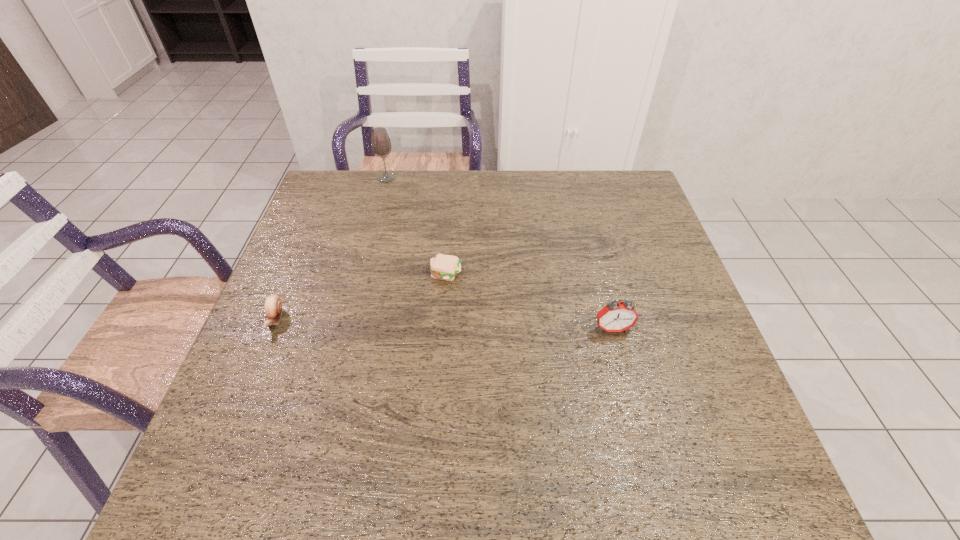
Where is `vacant region at the near right corner`? vacant region at the near right corner is located at coordinates (701, 464).

Find the location of `empty space between the rightmost object and the third object from right to left`. empty space between the rightmost object and the third object from right to left is located at coordinates (499, 253).

You are a GUI agent. You are given a task and a screenshot of the screen. Output one action in this format:
    pyautogui.click(x=<x>, y=<y>)
    Task: Click on the vacant area between the third shortest object and the tallest object
    This screenshot has width=960, height=540.
    Given the screenshot: What is the action you would take?
    pyautogui.click(x=499, y=253)

This screenshot has height=540, width=960. Identify the location of free spot between the tallest object and the second farthest object. (417, 226).

Locate an element on the screen. Image resolution: width=960 pixels, height=540 pixels. vacant point located between the glass drink container and the leftmost object is located at coordinates (331, 248).

You are a GUI agent. You are given a task and a screenshot of the screen. Output one action in this format:
    pyautogui.click(x=<x>, y=<y>)
    Task: Click on the empty space that is in between the third object from left to right and the second shortest object
    This screenshot has width=960, height=540.
    Given the screenshot: What is the action you would take?
    pyautogui.click(x=361, y=296)

Locate an element on the screen. The image size is (960, 540). free spot between the shortest object and the leftmost object is located at coordinates (361, 296).

Identify the location of vacant space that's between the second farthest object and the alarm clock. The image size is (960, 540). (529, 301).

This screenshot has width=960, height=540. Identify the location of vacant point located between the third nearest object and the rightmost object. (529, 301).

Locate an element on the screen. The height and width of the screenshot is (540, 960). free point between the rightmost object and the second object from left to right is located at coordinates (499, 253).